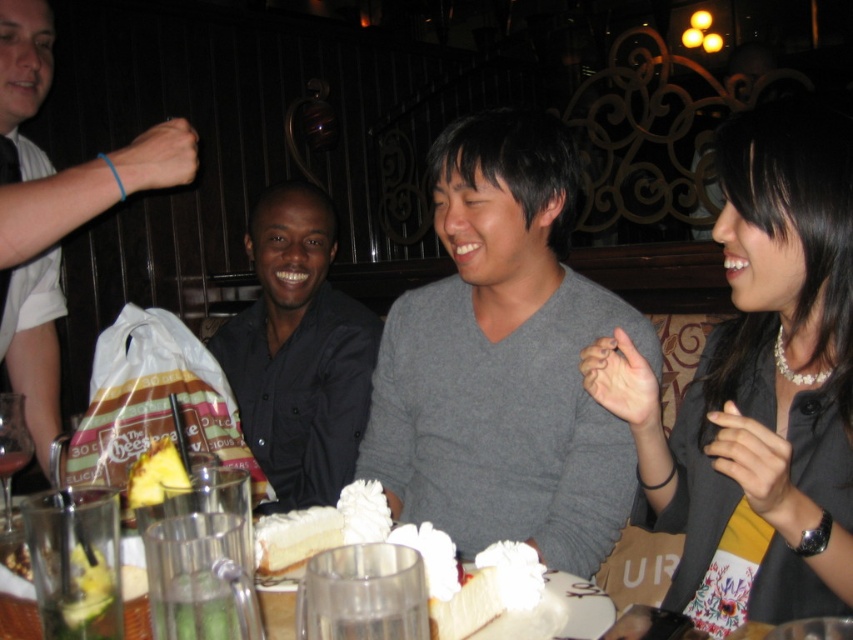
Consider the image. You are a photographer taking a picture of the scene. You notice two points in the image at coordinates point (502,524) and point (152,502). Which point will appear closer to the camera in the photo?

Point (152,502) is closer to the camera than point (502,524) because it has a smaller y coordinate, which in image coordinates typically indicates a closer position to the camera.

You are a server at the restaurant and need to place a new drink order on the table. The table has limited space. Which item should you move to make room, the gray sweater at center or the yellow pineapple at center?

You should move the gray sweater at center because it is larger in size than the yellow pineapple at center, making it easier to relocate to free up space.